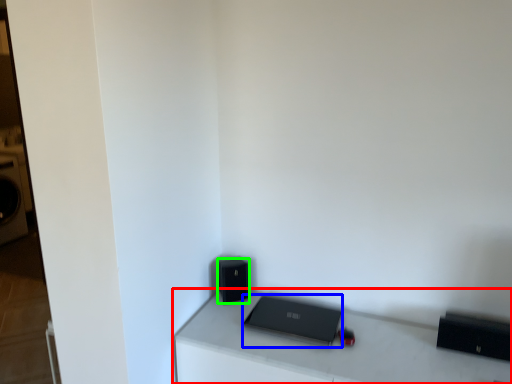
Question: Which is nearer to the furniture (highlighted by a red box)? laptop (highlighted by a blue box) or speaker (highlighted by a green box).

Choices:
 (A) laptop
 (B) speaker

Answer: (A)